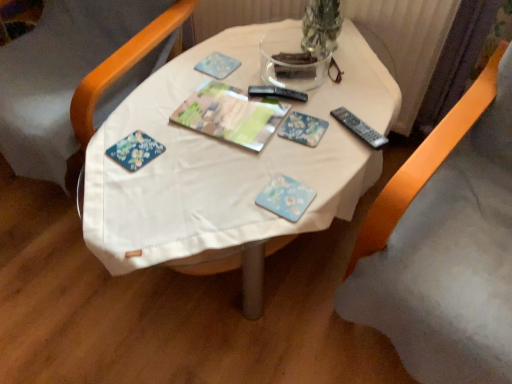
The image size is (512, 384). In order to click on empty space that is to the right of blue floral coaster at center, arranged as the first paperback book when ordered from the bottom in this screenshot , I will do click(x=333, y=184).